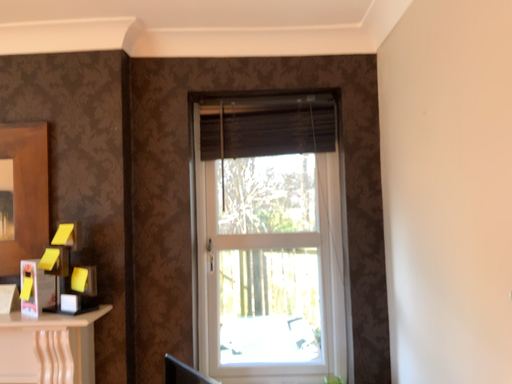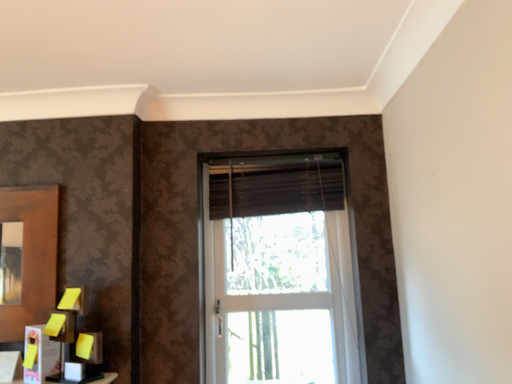
Question: How did the camera likely rotate when shooting the video?

Choices:
 (A) rotated downward
 (B) rotated upward

Answer: (B)